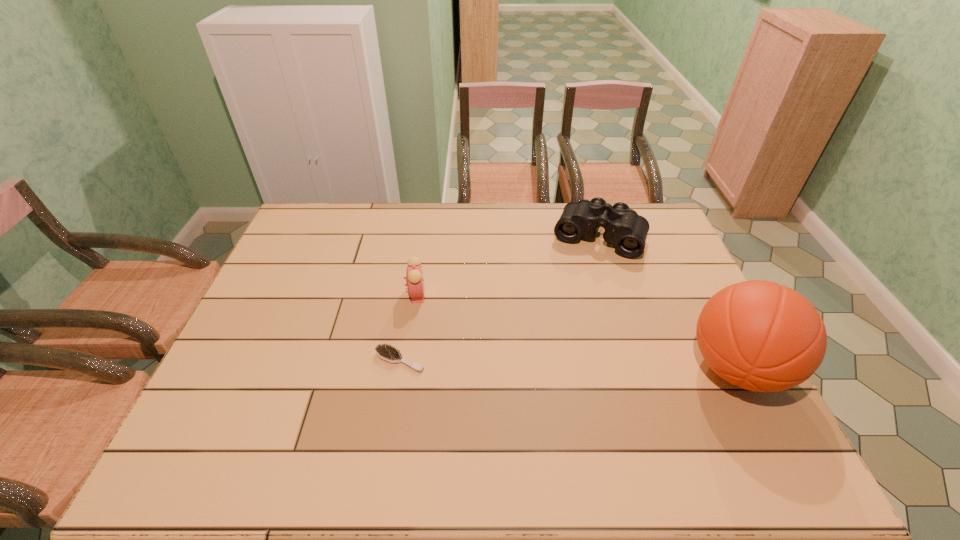
Locate an element on the screen. The width and height of the screenshot is (960, 540). vacant spot on the desktop that is between the shortest object and the basketball and is positioned on the face of the alarm clock is located at coordinates (563, 364).

Locate an element on the screen. The image size is (960, 540). free space on the desktop that is between the scrubbing brush and the basketball and is positioned at the eyepieces of the farthest object is located at coordinates (551, 364).